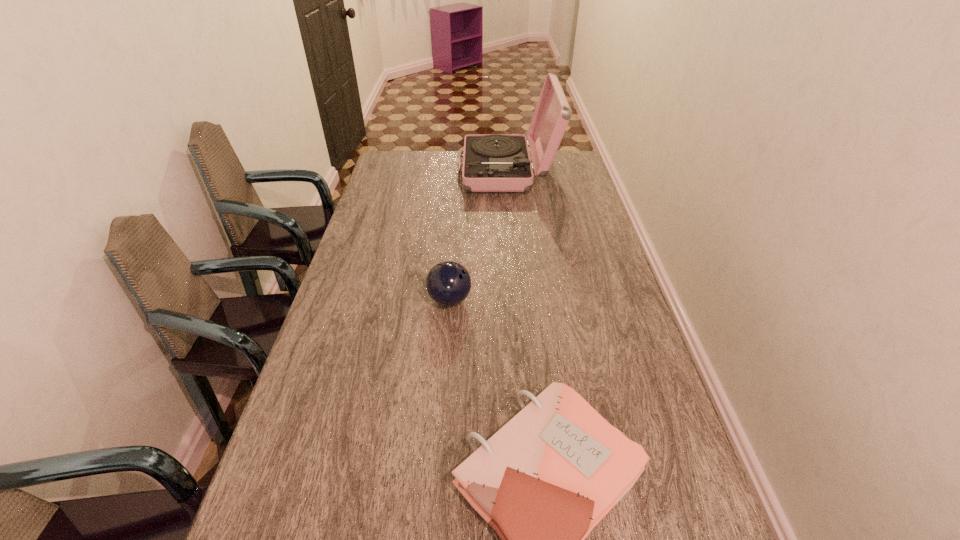
Identify the location of object that is at the far right corner. (491, 162).

In the image, there is a desktop. Where is `blank space at the left edge`? The height and width of the screenshot is (540, 960). blank space at the left edge is located at coordinates (349, 282).

Locate an element on the screen. The width and height of the screenshot is (960, 540). vacant area at the right edge of the desktop is located at coordinates (573, 279).

Image resolution: width=960 pixels, height=540 pixels. In order to click on vacant space at the far left corner in this screenshot , I will do `click(396, 162)`.

The width and height of the screenshot is (960, 540). I want to click on vacant point at the far right corner, so click(555, 174).

This screenshot has width=960, height=540. Find the location of `unoccupied position between the second shortest object and the tallest object`. unoccupied position between the second shortest object and the tallest object is located at coordinates (478, 236).

Locate an element on the screen. The height and width of the screenshot is (540, 960). free point between the second shortest object and the farthest object is located at coordinates (478, 236).

What are the coordinates of `object identified as the second closest to the second farthest object` in the screenshot? It's located at (491, 162).

Locate an element on the screen. The width and height of the screenshot is (960, 540). object that is the closest to the tallest object is located at coordinates (448, 283).